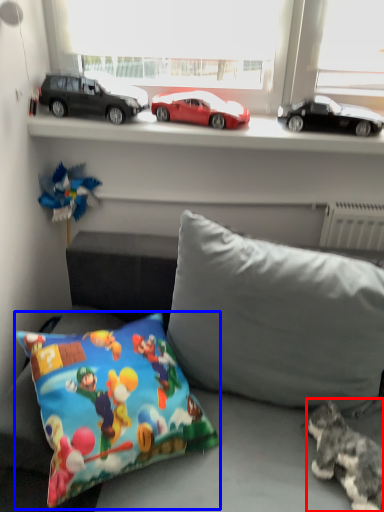
Question: Among these objects, which one is farthest to the camera, animal (highlighted by a red box) or pillow (highlighted by a blue box)?

Choices:
 (A) animal
 (B) pillow

Answer: (A)